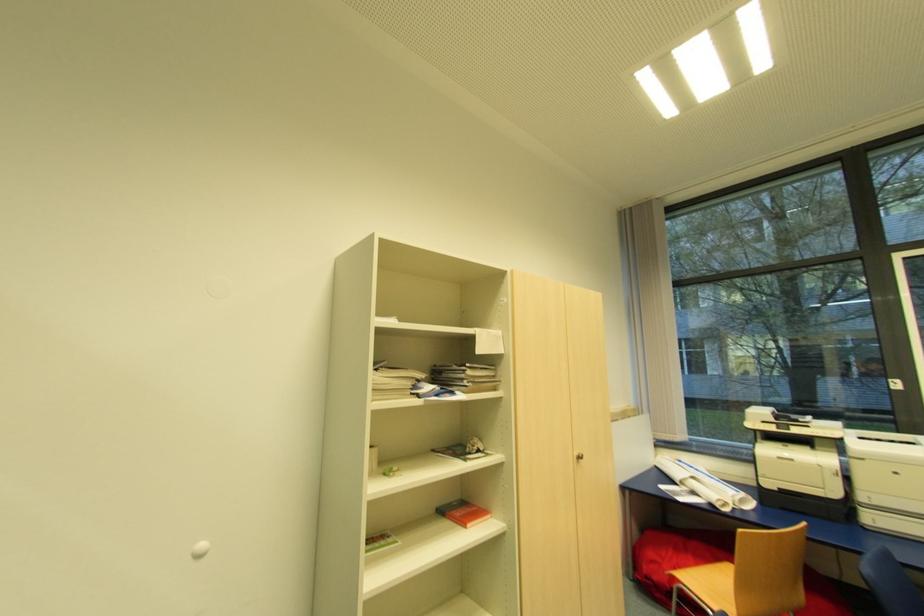
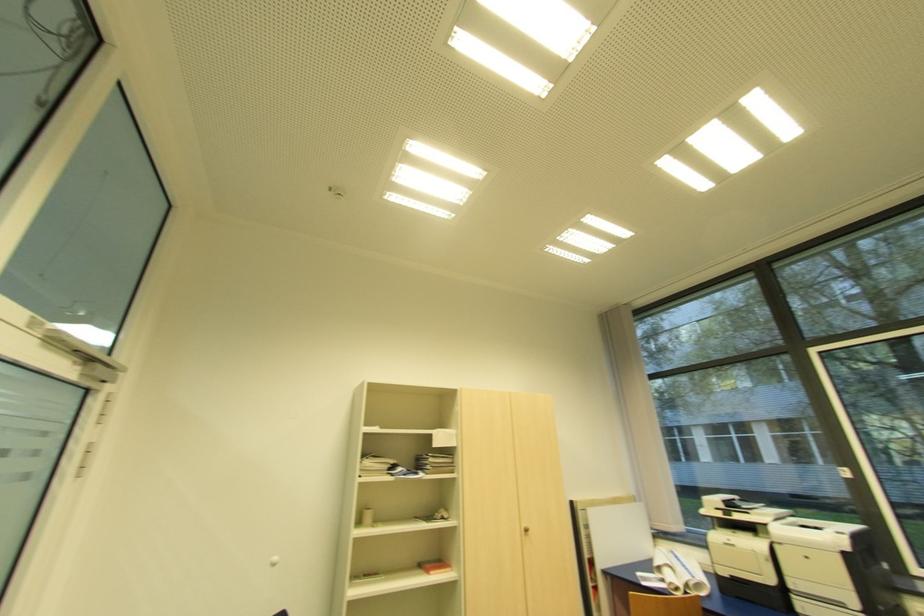
The images are taken continuously from a first-person perspective. In which direction are you moving?

The movement direction of the cameraman is right, backward.